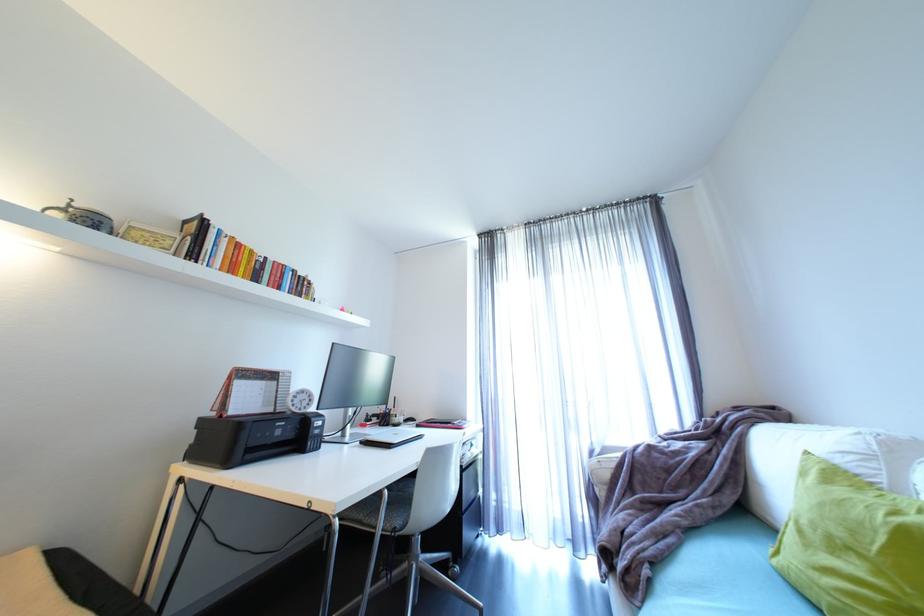
Find the location of a particular element. green pillow is located at coordinates (850, 544).